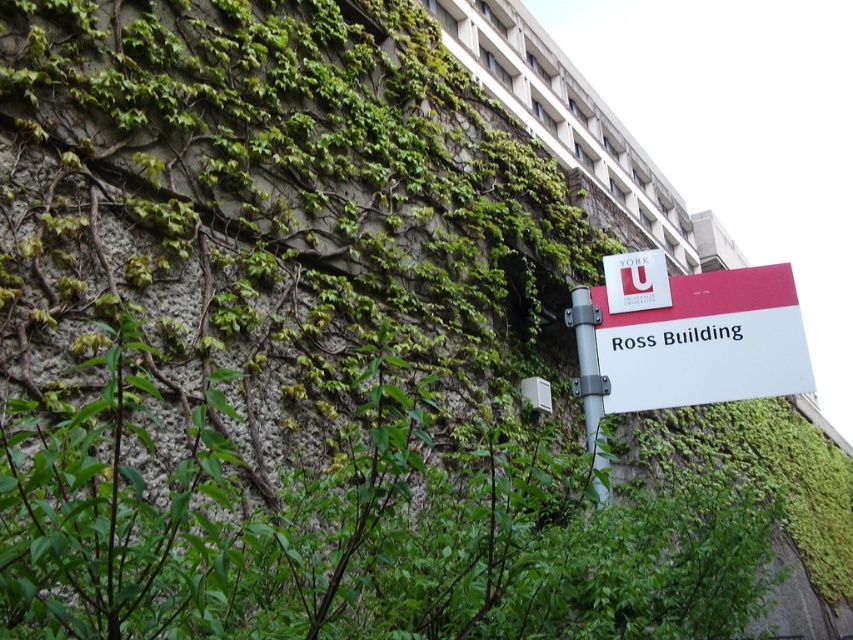
Can you confirm if white plastic sign at lower right is taller than matte red sign at center?

Correct, white plastic sign at lower right is much taller as matte red sign at center.

Can you confirm if white plastic sign at lower right is smaller than matte red sign at center?

Incorrect, white plastic sign at lower right is not smaller in size than matte red sign at center.

Image resolution: width=853 pixels, height=640 pixels. Identify the location of white plastic sign at lower right. (706, 342).

Which of these two, silver metallic pole at upper center or matte red sign at center, stands shorter?

With less height is matte red sign at center.

Is point (590, 448) less distant than point (622, 289)?

No, it is behind (622, 289).

This screenshot has height=640, width=853. What are the coordinates of `silver metallic pole at upper center` in the screenshot? It's located at (587, 368).

Can you confirm if white plastic sign at lower right is positioned to the left of silver metallic pole at upper center?

Incorrect, white plastic sign at lower right is not on the left side of silver metallic pole at upper center.

Who is more distant from viewer, (682, 305) or (598, 368)?

The point (682, 305) is more distant.

You are a GUI agent. You are given a task and a screenshot of the screen. Output one action in this format:
    pyautogui.click(x=<x>, y=<y>)
    Task: Click on the white plastic sign at lower right
    This screenshot has width=853, height=640.
    Given the screenshot: What is the action you would take?
    pyautogui.click(x=706, y=342)